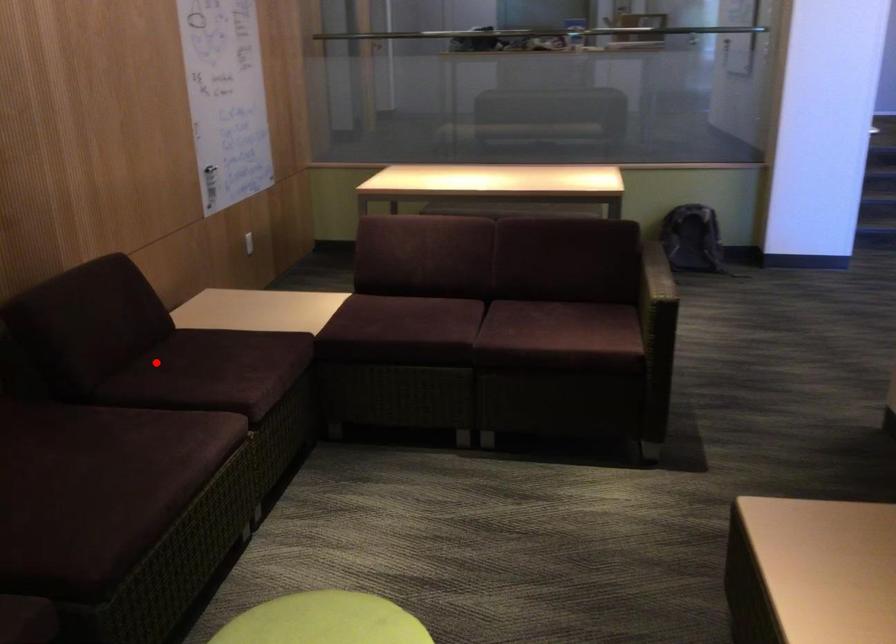
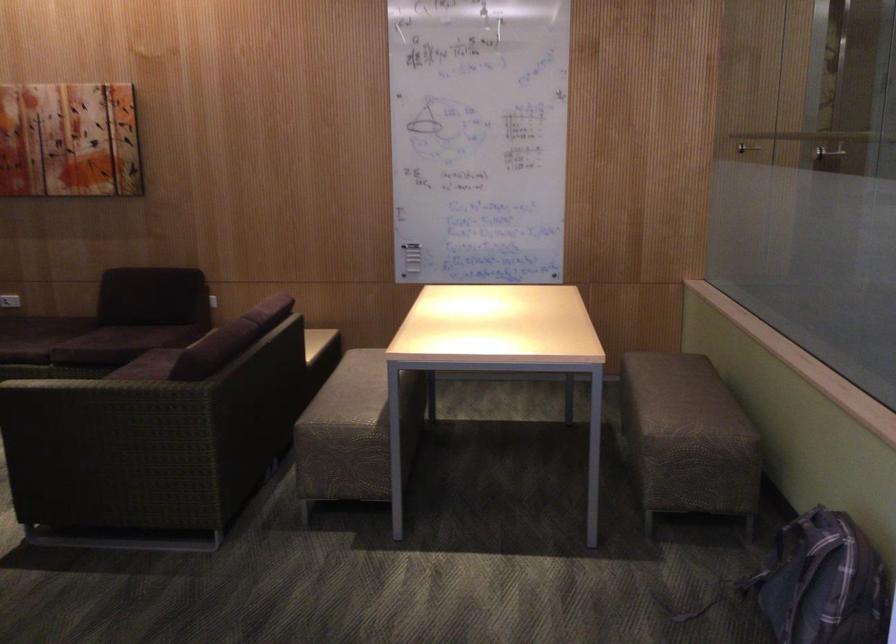
Where in the second image is the point corresponding to the highlighted location from the first image?

(123, 322)